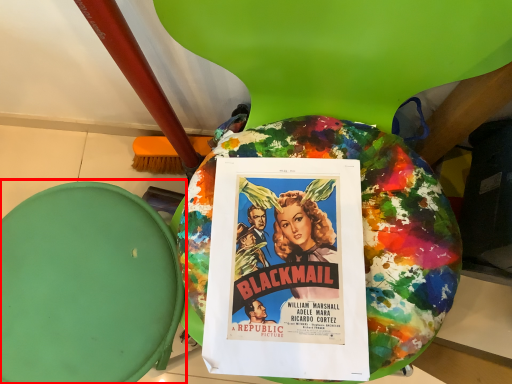
Question: In this image, where is bean bag chair (annotated by the red box) located relative to poster?

Choices:
 (A) left
 (B) right

Answer: (A)